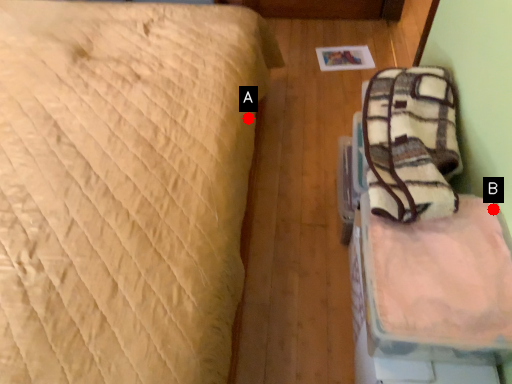
Question: Two points are circled on the image, labeled by A and B beside each circle. Which point appears farthest from the camera in this image?

Choices:
 (A) A is further
 (B) B is further

Answer: (A)